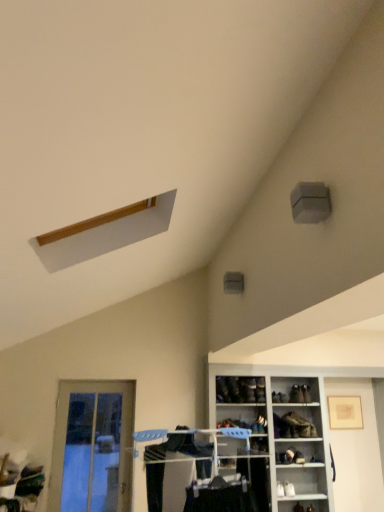
Question: Considering the relative positions of dark brown leather shoe at lower center, the 1th shoe from the left, and leather shoe at center, which appears as the second shoe when viewed from the left, in the image provided, is dark brown leather shoe at lower center, the 1th shoe from the left, behind leather shoe at center, which appears as the second shoe when viewed from the left,?

Choices:
 (A) yes
 (B) no

Answer: (B)

Question: From the image's perspective, is dark brown leather shoe at lower center, the 4th shoe from the right, under leather shoe at center, which appears as the second shoe when viewed from the left?

Choices:
 (A) yes
 (B) no

Answer: (B)

Question: Does dark brown leather shoe at lower center, the 4th shoe from the right, have a greater height compared to leather shoe at center, the 3th shoe from the right?

Choices:
 (A) yes
 (B) no

Answer: (A)

Question: Is dark brown leather shoe at lower center, the 1th shoe from the left, oriented towards leather shoe at center, which appears as the second shoe when viewed from the left?

Choices:
 (A) yes
 (B) no

Answer: (B)

Question: Can you see dark brown leather shoe at lower center, the 4th shoe from the right, touching leather shoe at center, which appears as the second shoe when viewed from the left?

Choices:
 (A) yes
 (B) no

Answer: (A)

Question: Is dark brown leather shoe at lower center, the 4th shoe from the right, closer to camera compared to leather shoe at center, the 3th shoe from the right?

Choices:
 (A) yes
 (B) no

Answer: (A)

Question: Considering the relative sizes of leather shoe at center, the 3th shoe from the right, and leather shoe at lower center, the fourth shoe from the left, in the image provided, is leather shoe at center, the 3th shoe from the right, smaller than leather shoe at lower center, the fourth shoe from the left,?

Choices:
 (A) no
 (B) yes

Answer: (A)

Question: Could leather shoe at lower center, the fourth shoe from the left, be considered to be inside leather shoe at center, which appears as the second shoe when viewed from the left?

Choices:
 (A) yes
 (B) no

Answer: (B)

Question: From a real-world perspective, does leather shoe at center, the 3th shoe from the right, sit lower than leather shoe at lower center, the fourth shoe from the left?

Choices:
 (A) yes
 (B) no

Answer: (B)

Question: Can you confirm if leather shoe at center, the 3th shoe from the right, is shorter than leather shoe at lower center, the fourth shoe from the left?

Choices:
 (A) yes
 (B) no

Answer: (B)

Question: From the image's perspective, is leather shoe at center, the 3th shoe from the right, below leather shoe at lower center, the fourth shoe from the left?

Choices:
 (A) no
 (B) yes

Answer: (A)

Question: Is leather shoe at center, the 3th shoe from the right, completely or partially outside of leather shoe at lower center, the fourth shoe from the left?

Choices:
 (A) no
 (B) yes

Answer: (B)

Question: Considering the relative sizes of matte plastic clothes rack at lower center and dark brown leather shoe at lower center, the 4th shoe from the right, in the image provided, is matte plastic clothes rack at lower center shorter than dark brown leather shoe at lower center, the 4th shoe from the right,?

Choices:
 (A) yes
 (B) no

Answer: (B)